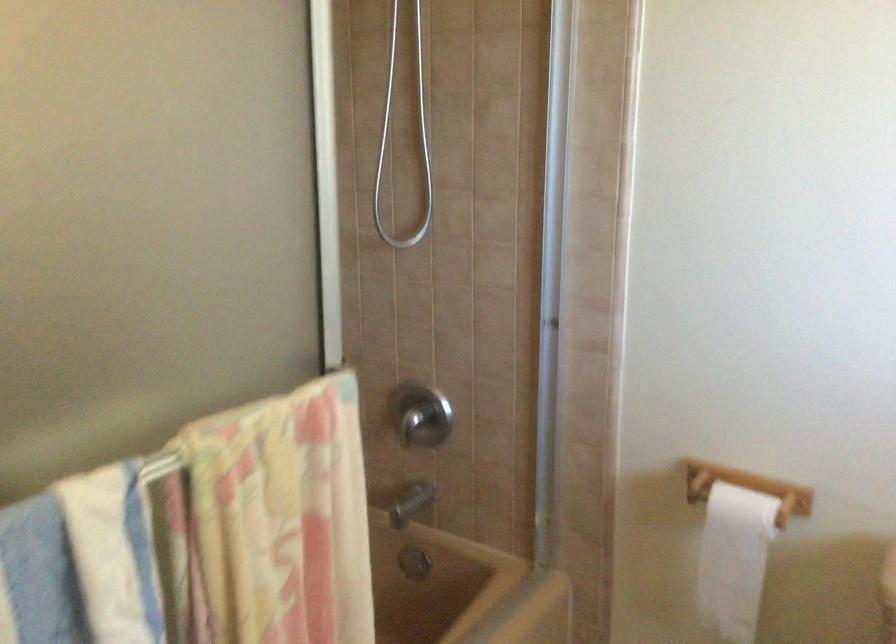
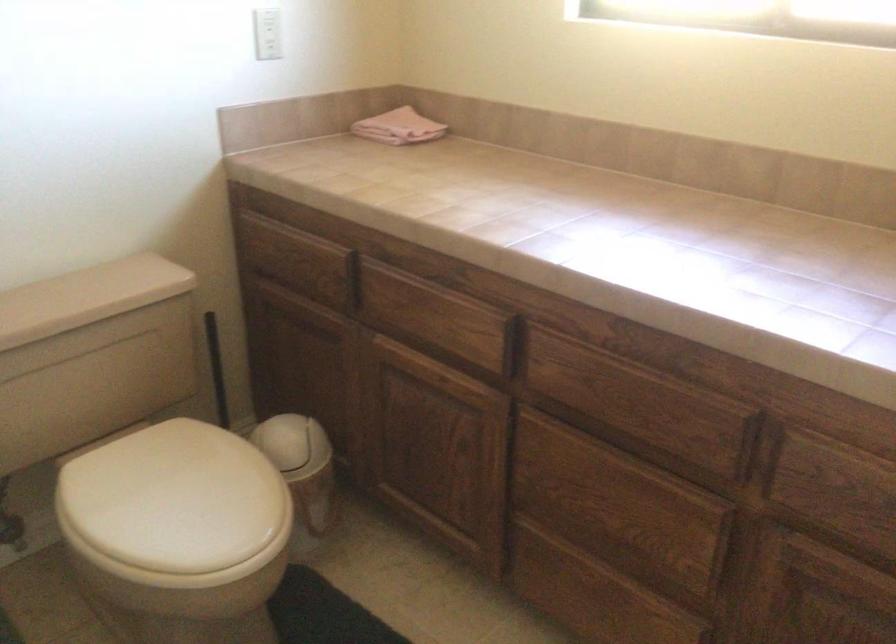
Based on the continuous images, in which direction is the camera rotating?

The camera rotated toward right-down.